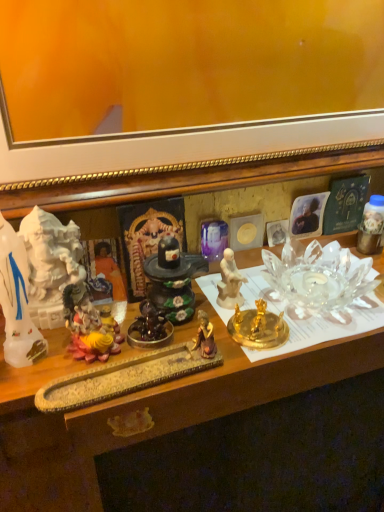
Locate an element on the screen. empty space that is to the right of shiny dark brown statue at center, arranged as the 4th toy when viewed from the right is located at coordinates (253, 324).